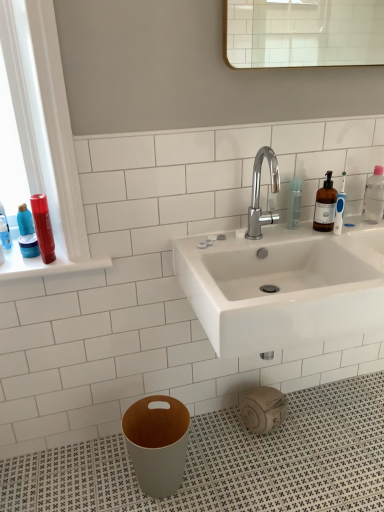
You are a GUI agent. You are given a task and a screenshot of the screen. Output one action in this format:
    pyautogui.click(x=<x>, y=<y>)
    Task: Click on the free space in front of clear plastic bottle at upper right
    This screenshot has width=384, height=512.
    Given the screenshot: What is the action you would take?
    pyautogui.click(x=320, y=237)